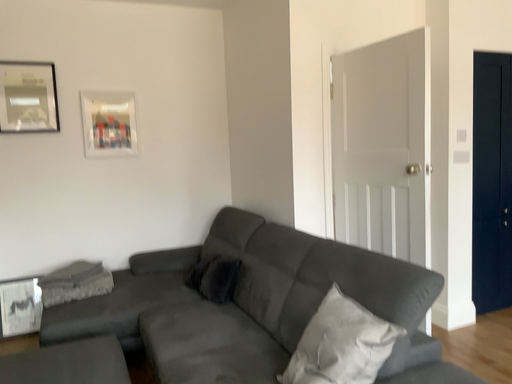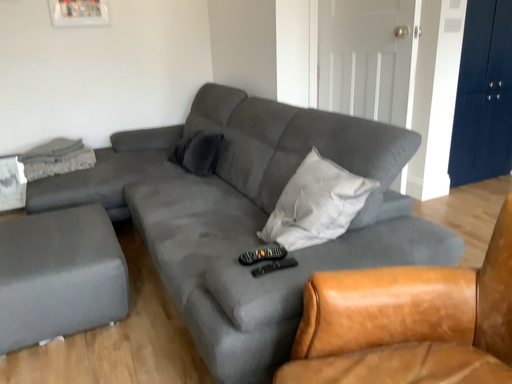
Question: Which way did the camera rotate in the video?

Choices:
 (A) rotated downward
 (B) rotated upward

Answer: (A)